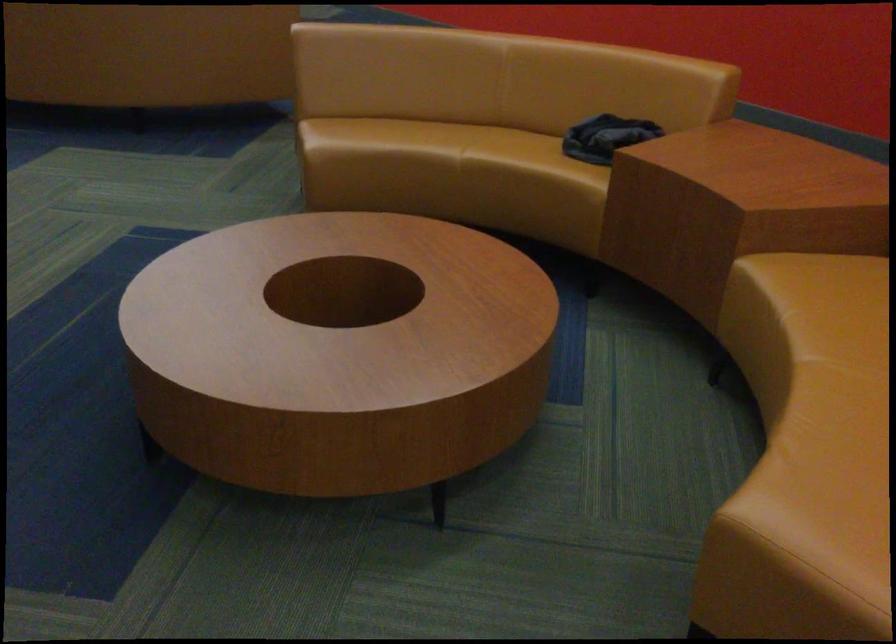
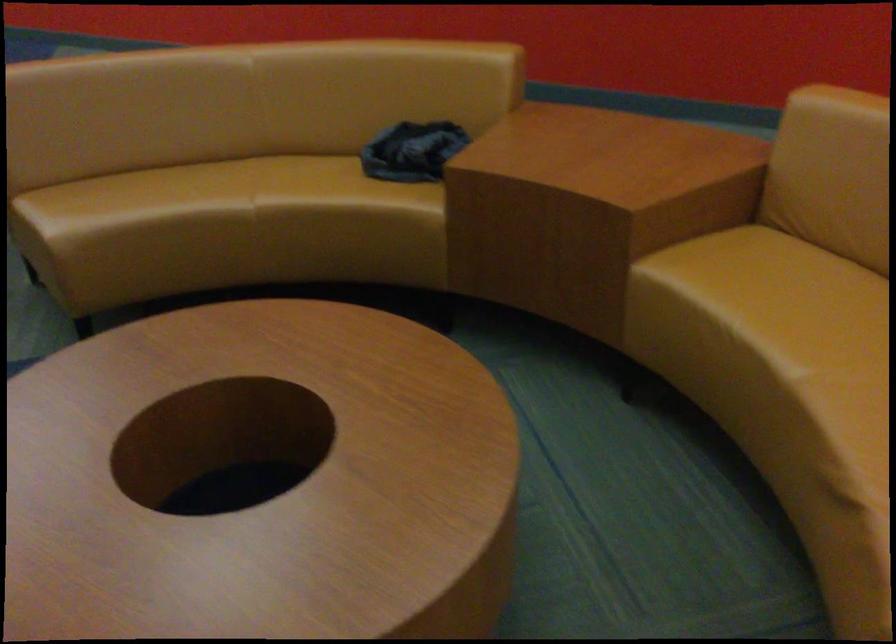
Question: How did the camera likely rotate?

Choices:
 (A) Left
 (B) Right
 (C) Up
 (D) Down

Answer: (B)